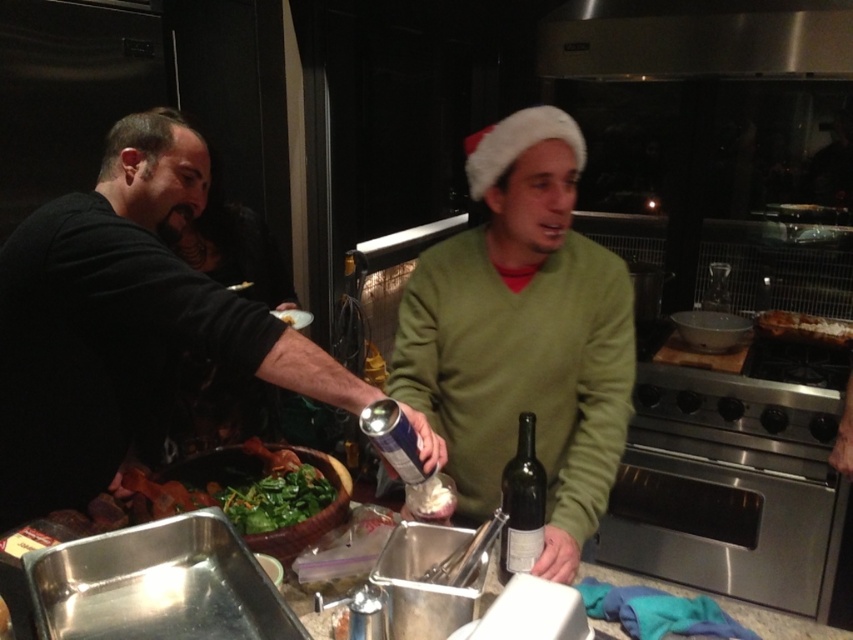
You are a guest at this festive gathering and want to grab the taller item between the matte glass bottle at center and the golden crispy pastry at right. Which one should you choose?

The matte glass bottle at center is taller than the golden crispy pastry at right, so you should choose the matte glass bottle at center.

You are a guest in the kitchen and want to pass between the green matte sweater at center and the stainless steel exhaust hood at upper center. Can you walk through the space between them comfortably?

The green matte sweater at center is narrower than the stainless steel exhaust hood at upper center, so there should be enough space to walk between them comfortably.